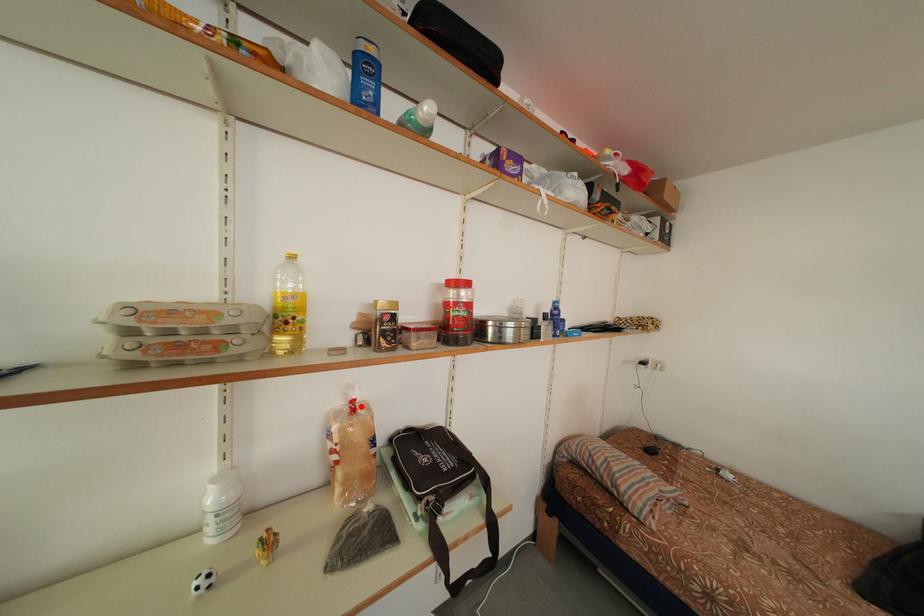
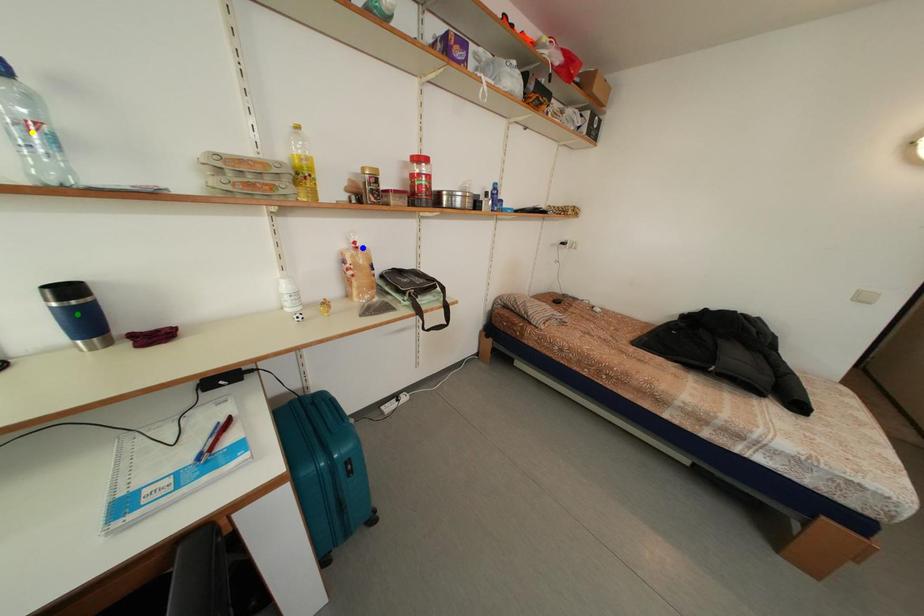
Question: I am providing you with two images of the same scene from different viewpoints. A red point is marked on the first image. You are given multiple points on the second image. Can you choose the point in image 2 that corresponds to the point in image 1?

Choices:
 (A) yellow point
 (B) green point
 (C) blue point

Answer: (C)